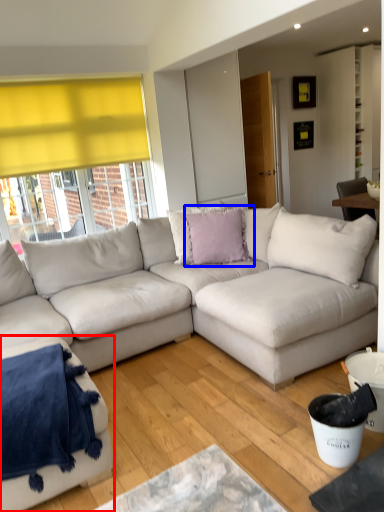
Question: Which object is further to the camera taking this photo, studio couch (highlighted by a red box) or pillow (highlighted by a blue box)?

Choices:
 (A) studio couch
 (B) pillow

Answer: (B)